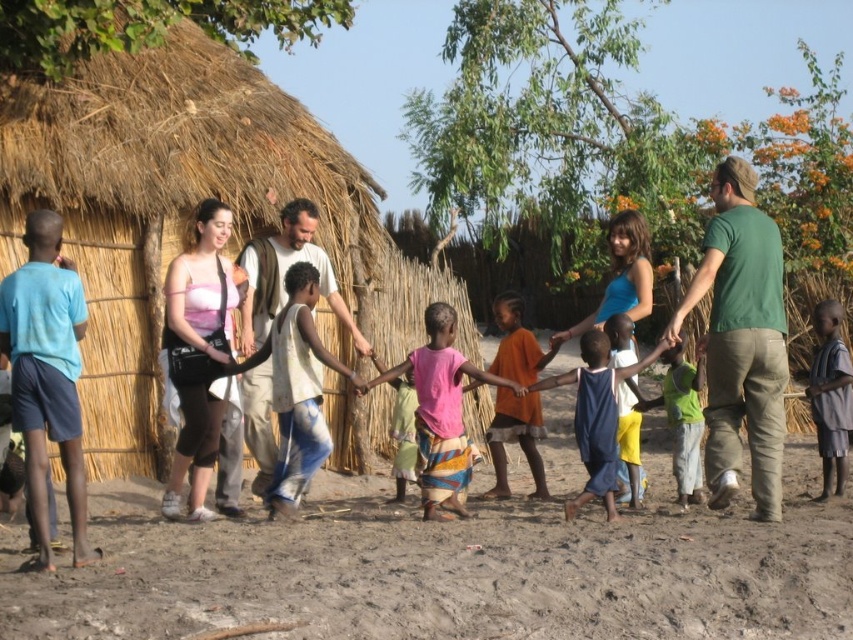
Can you confirm if blue fabric dress at center is positioned below green fabric shirt at center?

Yes.

Who is positioned more to the left, blue fabric dress at center or green fabric shirt at center?

blue fabric dress at center

Is point (579, 432) less distant than point (683, 394)?

Yes, it is.

Where is `blue fabric dress at center`? blue fabric dress at center is located at coordinates (596, 416).

Based on the photo, is green cotton shirt at right wider than pink fabric skirt at center?

Incorrect, green cotton shirt at right's width does not surpass pink fabric skirt at center's.

Who is more forward, (757, 317) or (428, 396)?

Positioned in front is point (757, 317).

The width and height of the screenshot is (853, 640). In order to click on green cotton shirt at right in this screenshot , I will do point(741,340).

I want to click on green cotton shirt at right, so click(741, 340).

Is brown sandy dirt at lower center wider than orange fabric skirt at center?

No.

You are a GUI agent. You are given a task and a screenshot of the screen. Output one action in this format:
    pyautogui.click(x=<x>, y=<y>)
    Task: Click on the brown sandy dirt at lower center
    
    Given the screenshot: What is the action you would take?
    pyautogui.click(x=450, y=573)